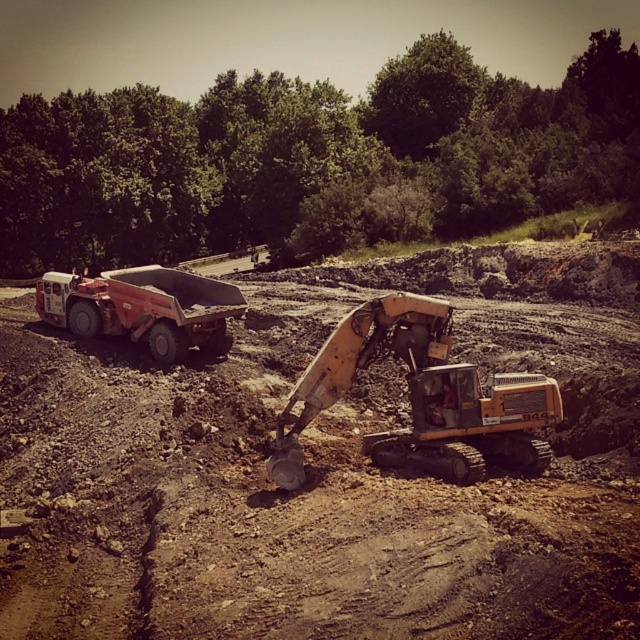
Can you confirm if yellow metallic excavator at center is shorter than matte red truck at left?

In fact, yellow metallic excavator at center may be taller than matte red truck at left.

Is point (385, 465) more distant than point (83, 304)?

That is False.

Locate an element on the screen. yellow metallic excavator at center is located at coordinates (420, 397).